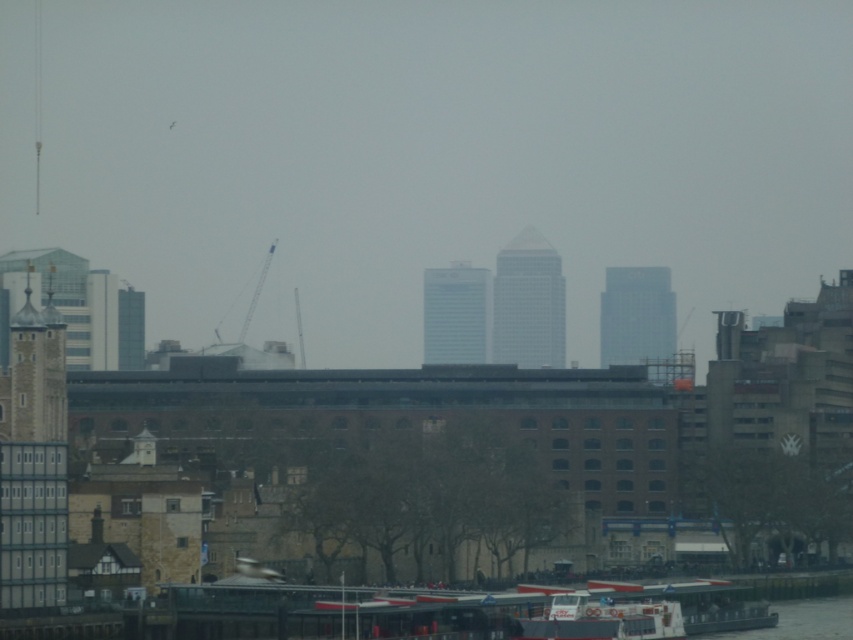
In the scene shown: You are standing on one of the boats in the foreground and looking towards the two skyscrapers. Which skyscraper, the glassy silver skyscraper at center or the glassy reflective skyscraper at left, is closer to you?

The glassy silver skyscraper at center is closer to you because the glassy reflective skyscraper at left is positioned behind it.

You are standing at point [636,316] in the image. What do you see directly in front of you?

Answer: You see a glassy gray skyscraper at center directly in front of you at point [636,316].

You are an architect analyzing the urban skyline. You observe the glassy silver skyscraper at center and the glassy reflective skyscraper at left. Which of these two buildings has a greater width?

The glassy silver skyscraper at center has a greater width than the glassy reflective skyscraper at left.